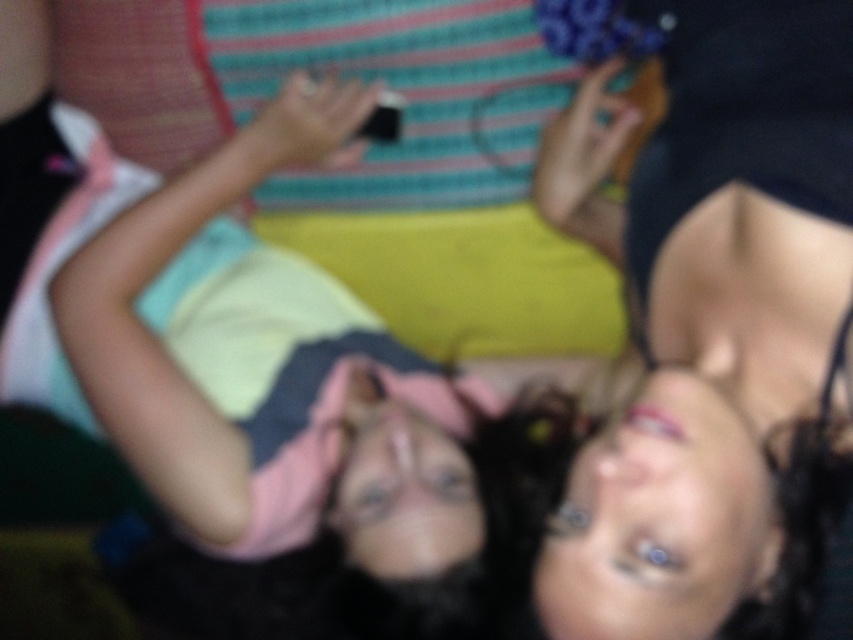
Can you confirm if smooth skin face at upper center is bigger than pink fabric at center?

Actually, smooth skin face at upper center might be smaller than pink fabric at center.

Describe the element at coordinates (720, 180) in the screenshot. Image resolution: width=853 pixels, height=640 pixels. I see `smooth skin face at upper center` at that location.

Who is more distant from viewer, [683,28] or [30,362]?

Point [30,362]

At what (x,y) coordinates should I click in order to perform the action: click on smooth skin face at upper center. Please return your answer as a coordinate pair (x, y). Image resolution: width=853 pixels, height=640 pixels. Looking at the image, I should click on (720, 180).